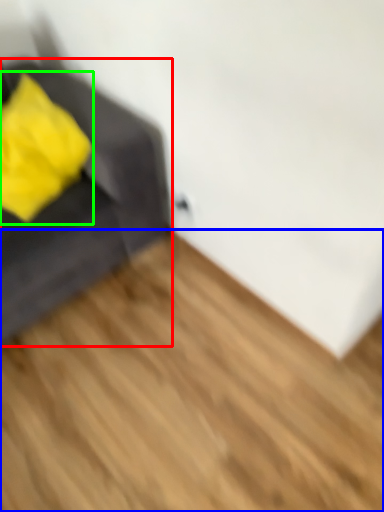
Question: Estimate the real-world distances between objects in this image. Which object is farther from furniture (highlighted by a red box), hardwood (highlighted by a blue box) or throw pillow (highlighted by a green box)?

Choices:
 (A) hardwood
 (B) throw pillow

Answer: (A)